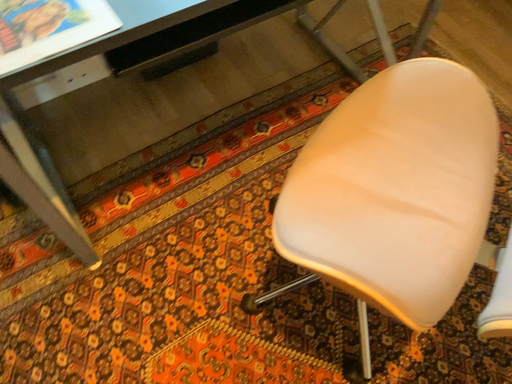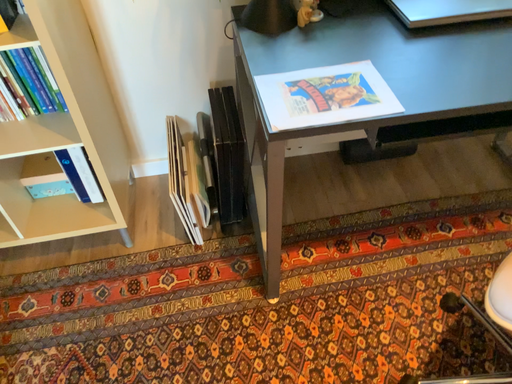
Question: How did the camera likely rotate when shooting the video?

Choices:
 (A) rotated upward
 (B) rotated downward

Answer: (A)